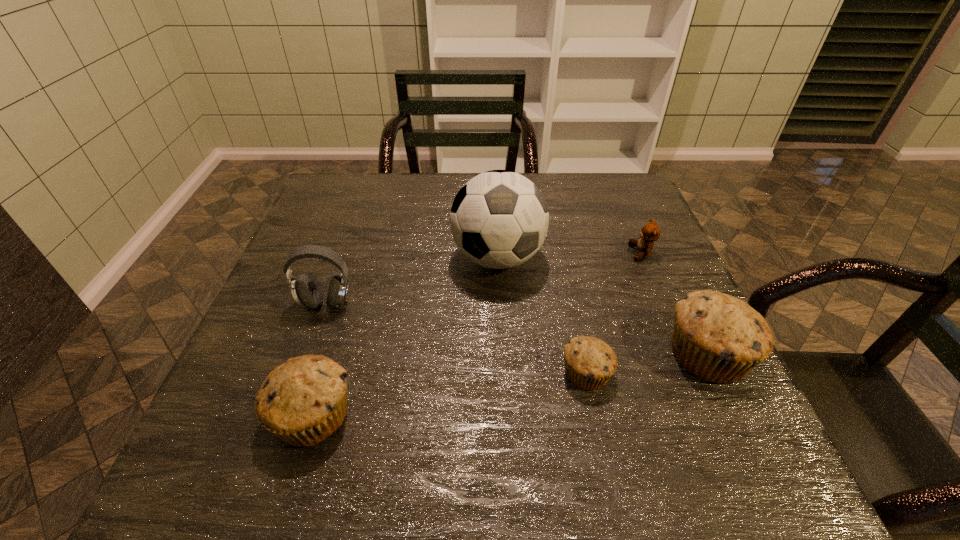
Locate an element on the screen. This screenshot has height=540, width=960. vacant space located 0.160m on the main logo of the soccer ball is located at coordinates (502, 345).

This screenshot has width=960, height=540. What are the coordinates of `vacant space located 0.390m on the front-facing side of the teddy bear` in the screenshot? It's located at (476, 253).

Identify the location of vacant space situated on the front-facing side of the teddy bear. (579, 253).

Identify the location of free space located 0.120m on the front-facing side of the teddy bear. (583, 253).

The height and width of the screenshot is (540, 960). I want to click on free spot located on the ear cups of the third farthest object, so click(288, 412).

Where is `muffin located in the left edge section of the desktop`? muffin located in the left edge section of the desktop is located at coordinates (303, 401).

Locate an element on the screen. The image size is (960, 540). headset at the left edge is located at coordinates (307, 292).

I want to click on muffin present at the right edge, so click(719, 338).

Identify the location of teddy bear that is at the right edge. The width and height of the screenshot is (960, 540). (650, 232).

The height and width of the screenshot is (540, 960). I want to click on object positioned at the near left corner, so click(x=303, y=401).